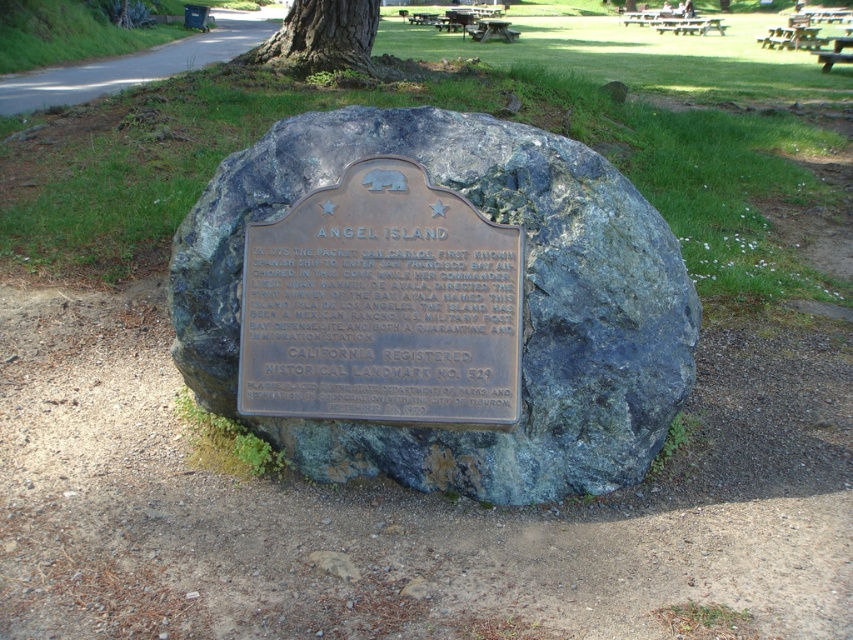
Question: Which of the following is the closest to the observer?

Choices:
 (A) (357, 401)
 (B) (376, 467)
 (C) (270, 58)

Answer: (A)

Question: Which object is positioned closest to the smooth bark tree at center?

Choices:
 (A) greenish-blue rock at center
 (B) bronze plaque at center

Answer: (A)

Question: Is greenish-blue rock at center positioned behind bronze plaque at center?

Choices:
 (A) no
 (B) yes

Answer: (B)

Question: Can you confirm if bronze plaque at center is thinner than smooth bark tree at center?

Choices:
 (A) yes
 (B) no

Answer: (A)

Question: Which point is closer to the camera?

Choices:
 (A) (328, 64)
 (B) (437, 179)
 (C) (430, 244)

Answer: (C)

Question: Is greenish-blue rock at center positioned at the back of bronze plaque at center?

Choices:
 (A) no
 (B) yes

Answer: (B)